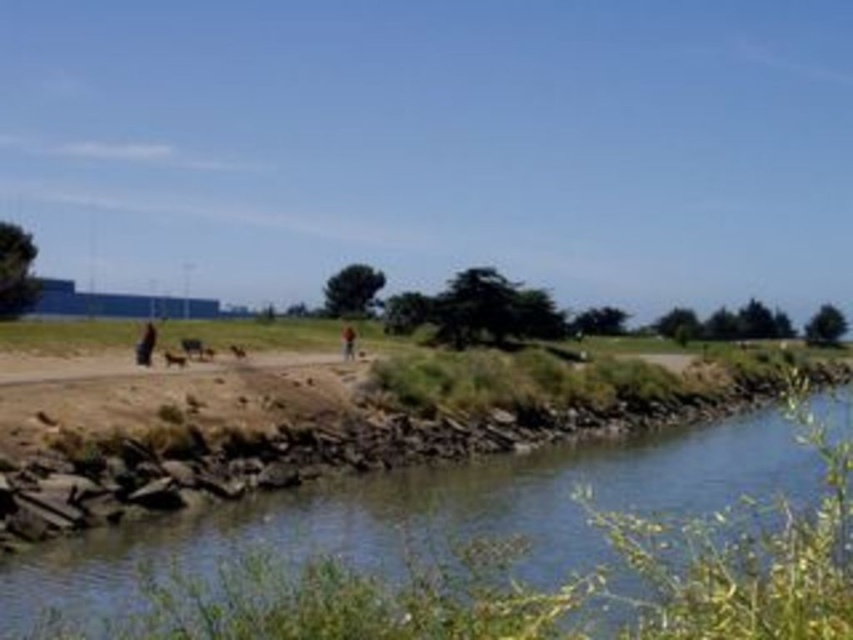
Which is behind, point (357, 492) or point (149, 336)?

Point (149, 336)

Can you confirm if clear water at lower left is positioned to the right of dark blue jeans at center?

Yes, clear water at lower left is to the right of dark blue jeans at center.

Identify the location of clear water at lower left. The image size is (853, 640). (660, 476).